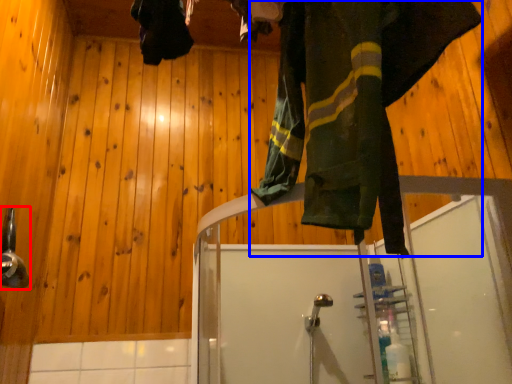
Question: Which object appears closest to the camera in this image, shower (highlighted by a red box) or clothing (highlighted by a blue box)?

Choices:
 (A) shower
 (B) clothing

Answer: (B)